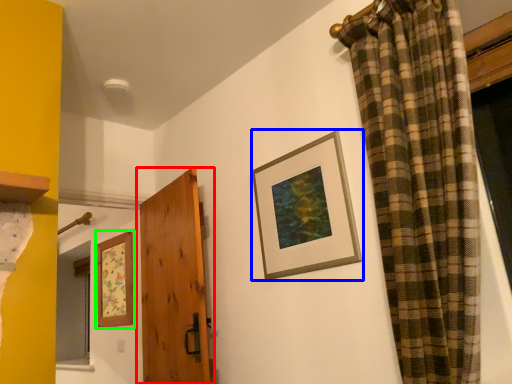
Question: Which is nearer to the door (highlighted by a red box)? picture frame (highlighted by a blue box) or picture frame (highlighted by a green box).

Choices:
 (A) picture frame
 (B) picture frame

Answer: (B)